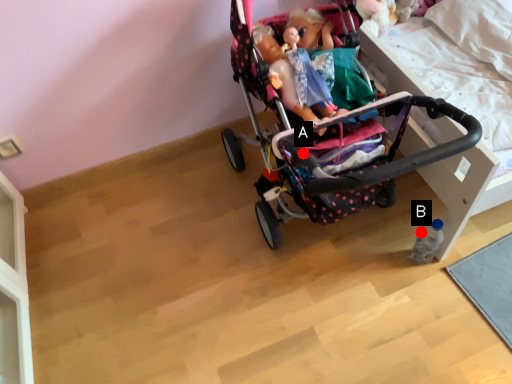
Question: Two points are circled on the image, labeled by A and B beside each circle. Which point appears farthest from the camera in this image?

Choices:
 (A) A is further
 (B) B is further

Answer: (B)